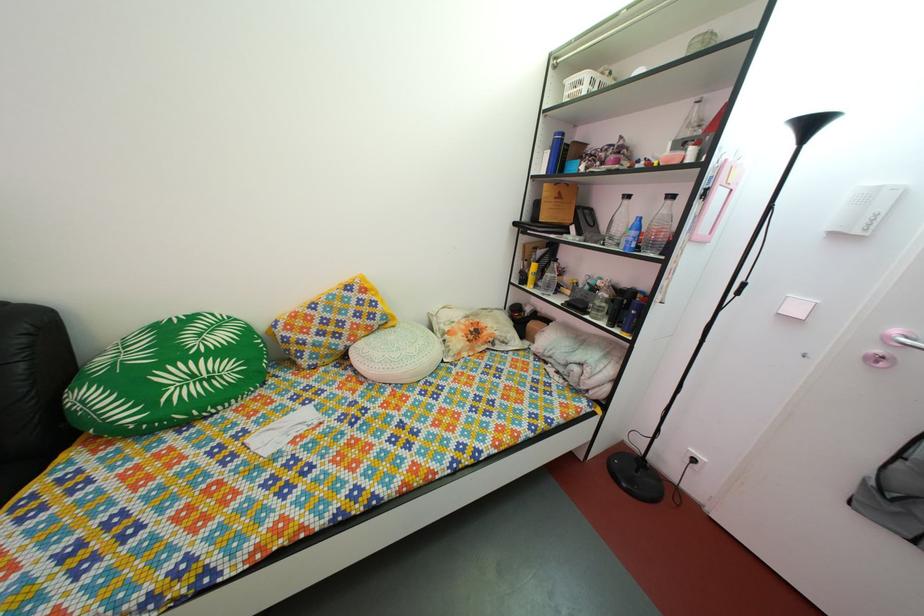
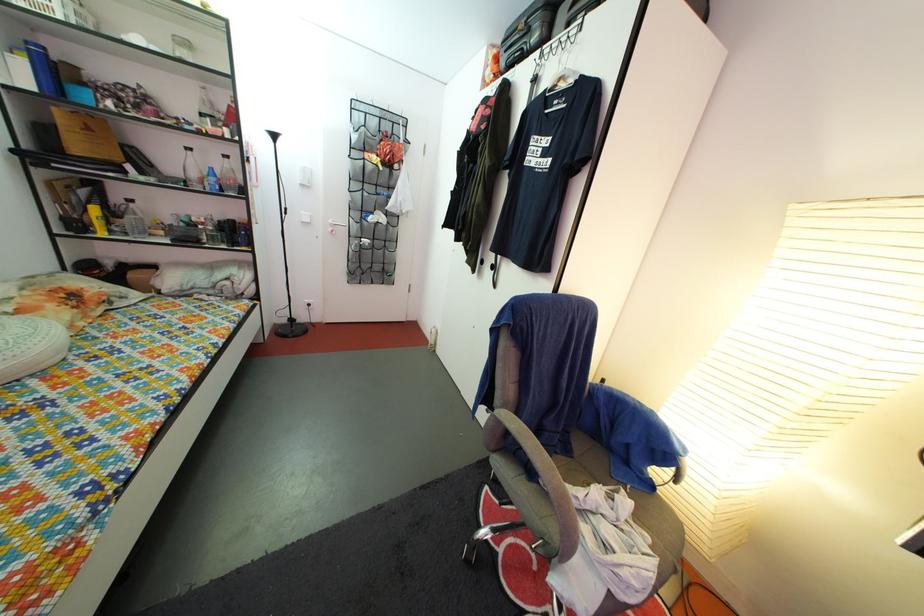
Locate, in the second image, the point that corresponds to (396,374) in the first image.

(9, 366)